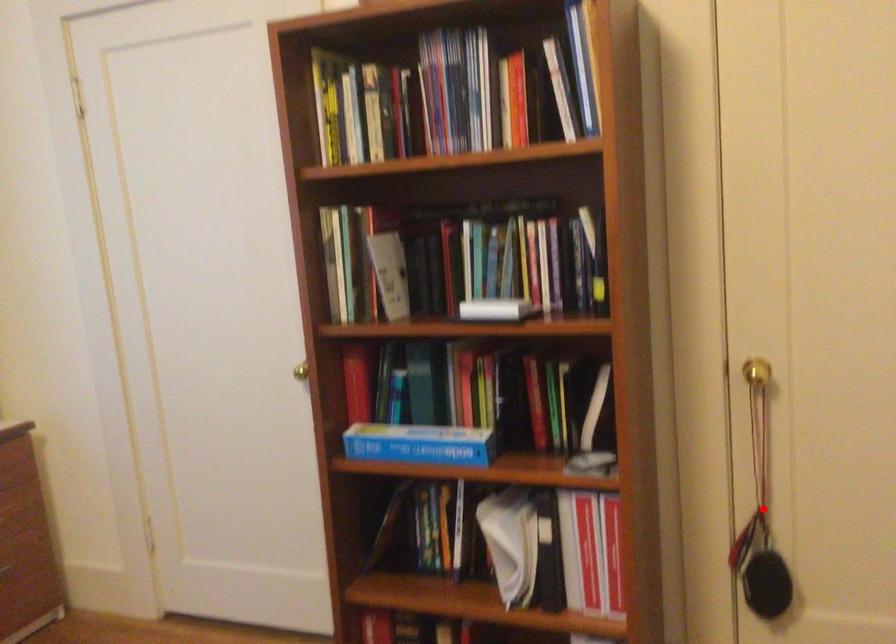
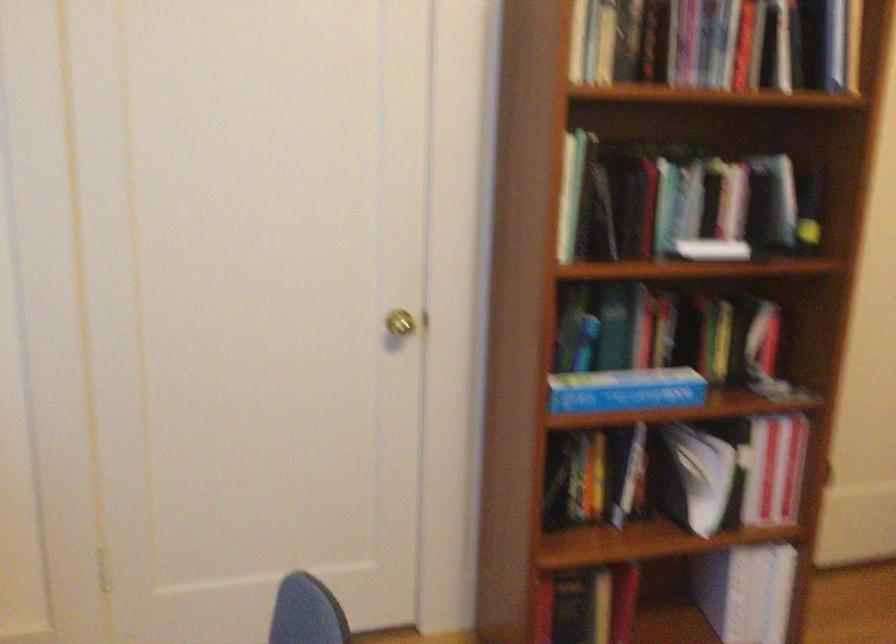
Question: I am providing you with two images of the same scene from different viewpoints. A red point is marked on the first image. Is the red point's position out of view in image 2?

Choices:
 (A) Yes
 (B) No

Answer: (A)